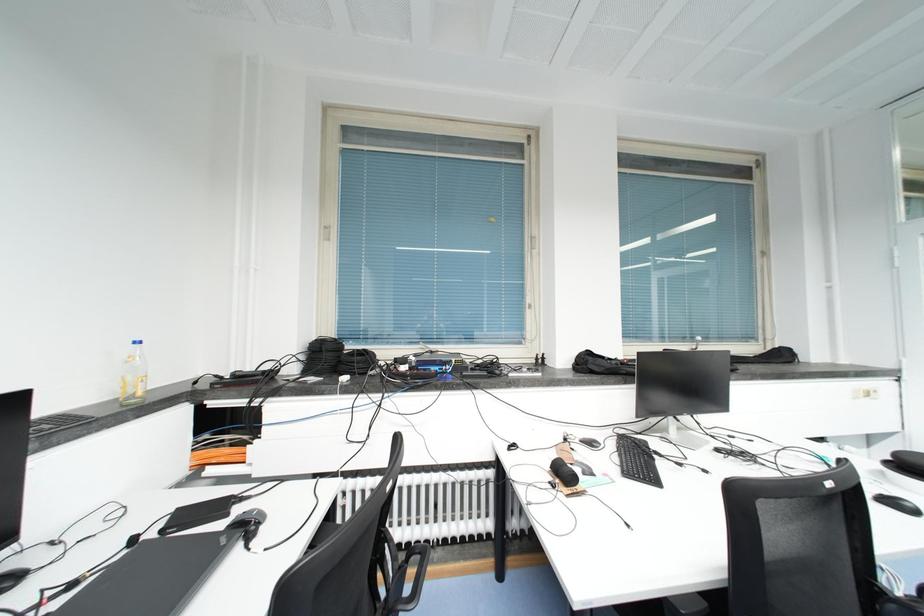
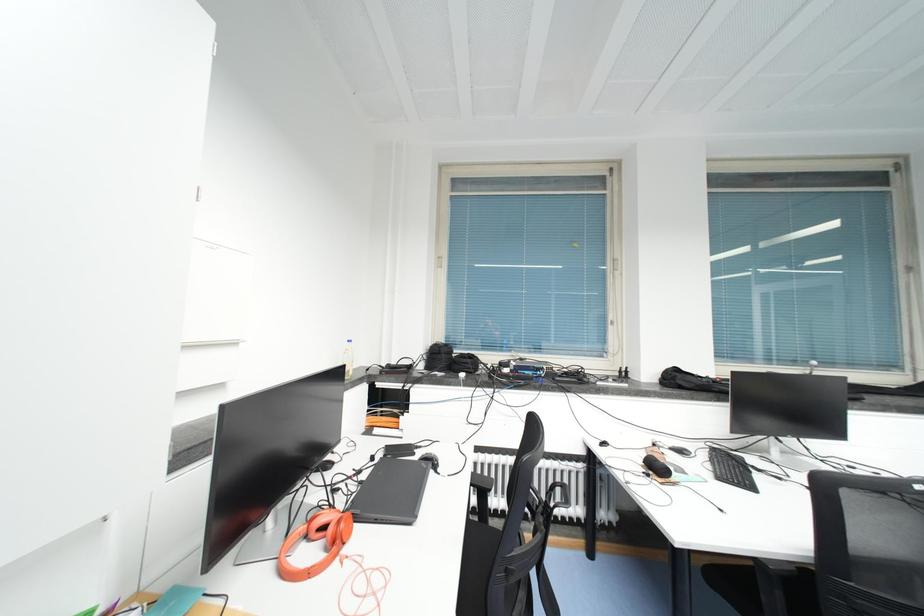
Question: The images are taken continuously from a first-person perspective. In which direction is your viewpoint rotating?

Choices:
 (A) Left
 (B) Right
 (C) Up
 (D) Down

Answer: (A)